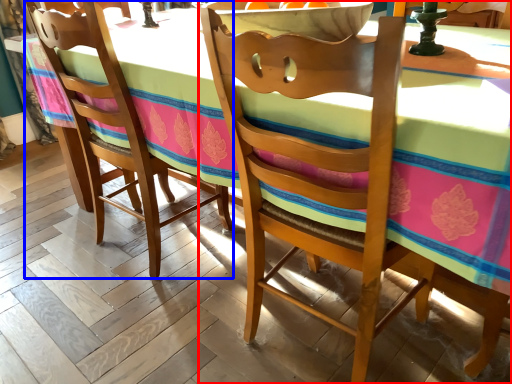
Question: Which object appears closest to the camera in this image, chair (highlighted by a red box) or chair (highlighted by a blue box)?

Choices:
 (A) chair
 (B) chair

Answer: (A)